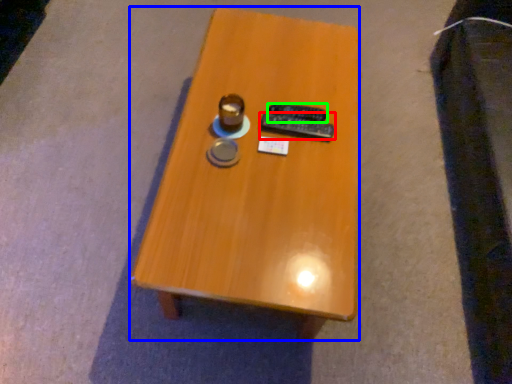
Question: Which is nearer to the remote control (highlighted by a red box)? table (highlighted by a blue box) or remote control (highlighted by a green box).

Choices:
 (A) table
 (B) remote control

Answer: (B)